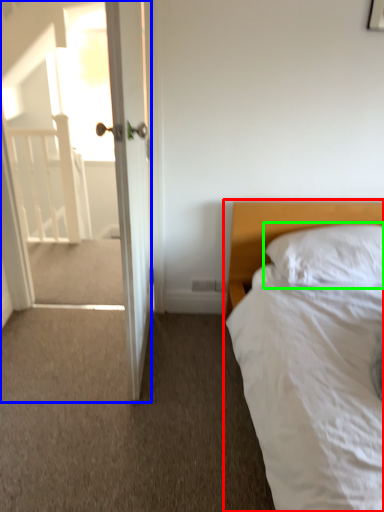
Question: Which object is the closest to the bed (highlighted by a red box)? Choose among these: screen door (highlighted by a blue box) or pillow (highlighted by a green box).

Choices:
 (A) screen door
 (B) pillow

Answer: (B)